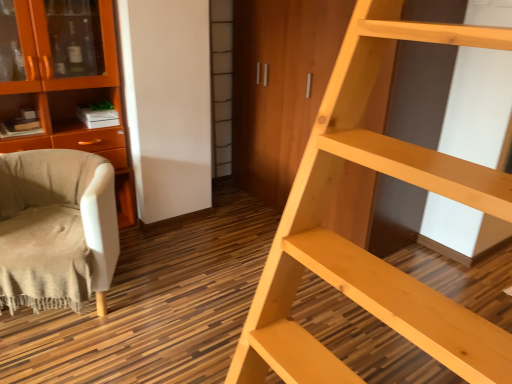
Where is `empty space that is to the right of orange wood cabinet at left`? The width and height of the screenshot is (512, 384). empty space that is to the right of orange wood cabinet at left is located at coordinates (157, 244).